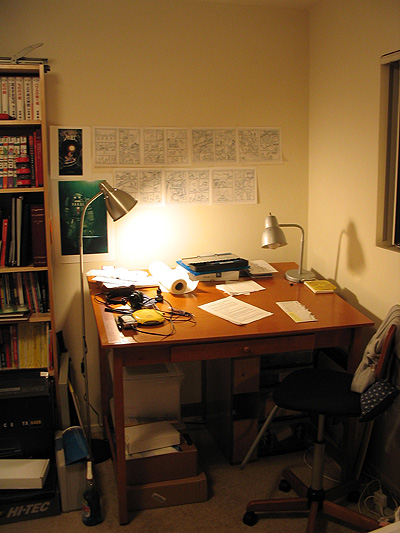
Identify the location of lamp. (114, 201), (276, 233).